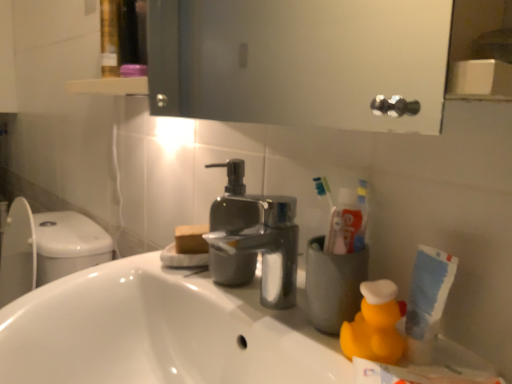
This screenshot has width=512, height=384. What are the coordinates of `vacant space situated on the left part of polished metallic faucet at center` in the screenshot? It's located at (142, 273).